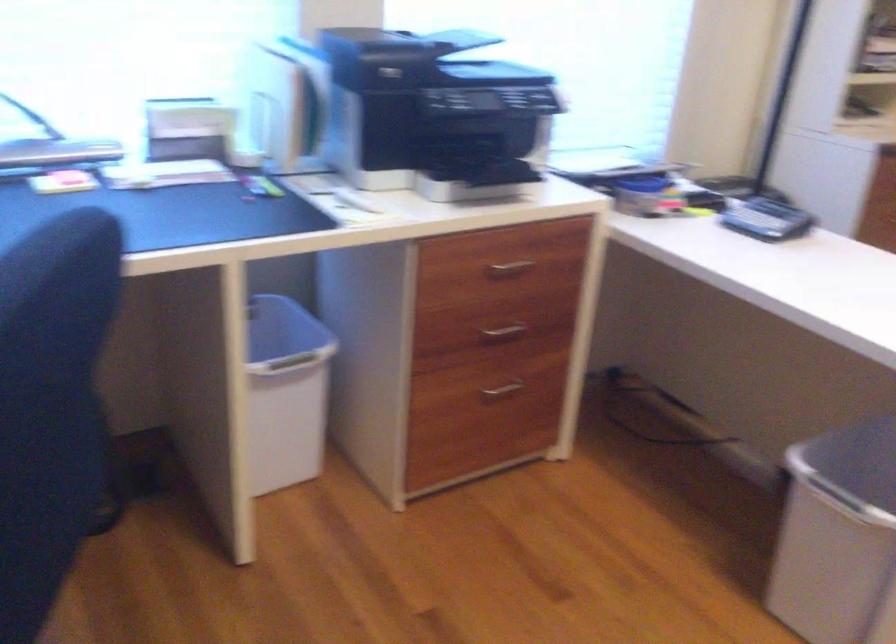
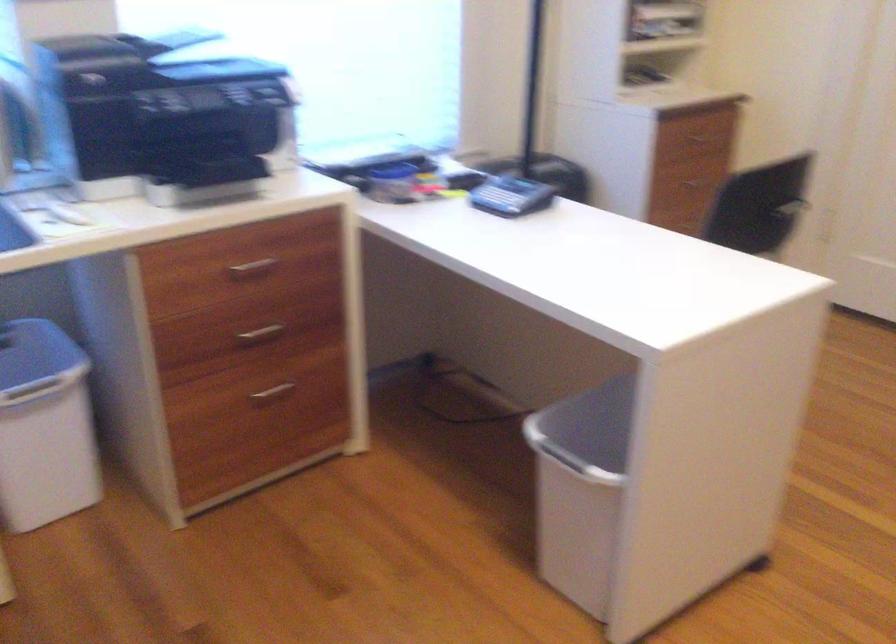
Question: In a continuous first-person perspective shot, in which direction is the camera moving?

Choices:
 (A) Left
 (B) Right
 (C) Forward
 (D) Backward

Answer: (B)